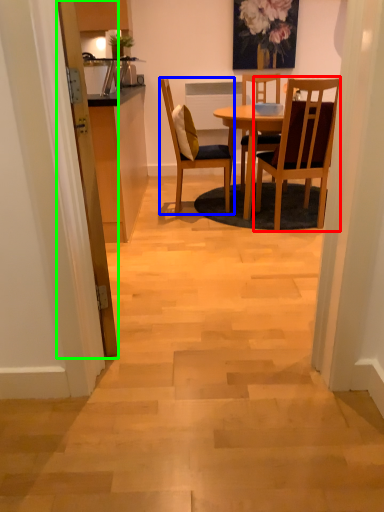
Question: Which is nearer to the chair (highlighted by a red box)? chair (highlighted by a blue box) or door (highlighted by a green box).

Choices:
 (A) chair
 (B) door

Answer: (A)